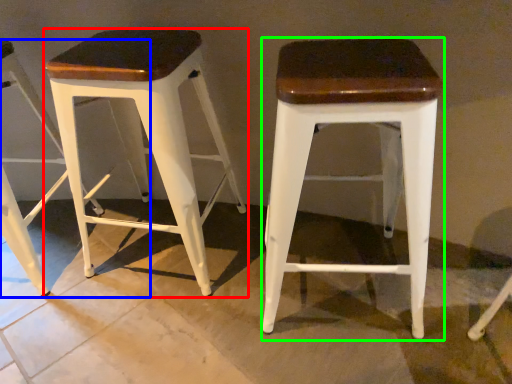
Question: Which object is the closest to the stool (highlighted by a red box)? Choose among these: stool (highlighted by a blue box) or stool (highlighted by a green box).

Choices:
 (A) stool
 (B) stool

Answer: (A)